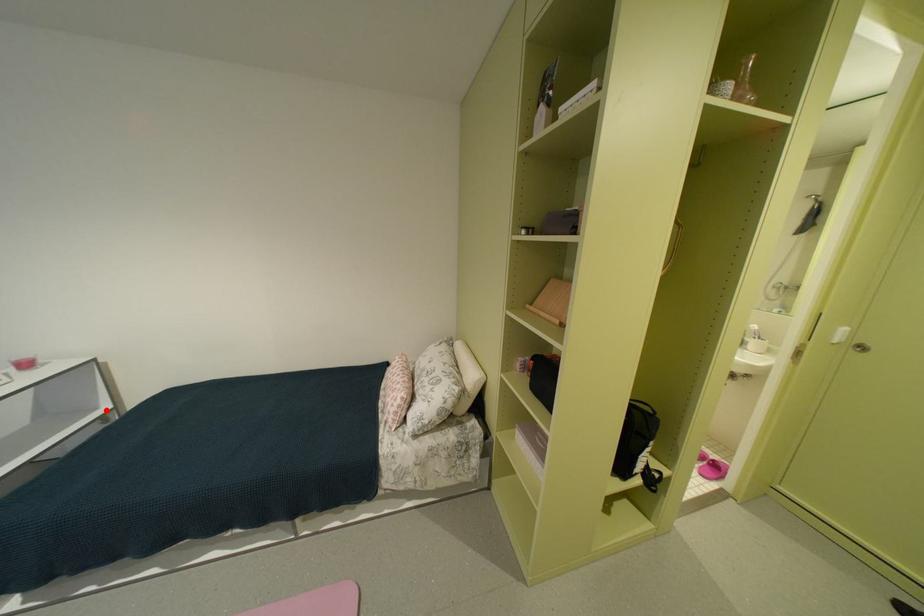
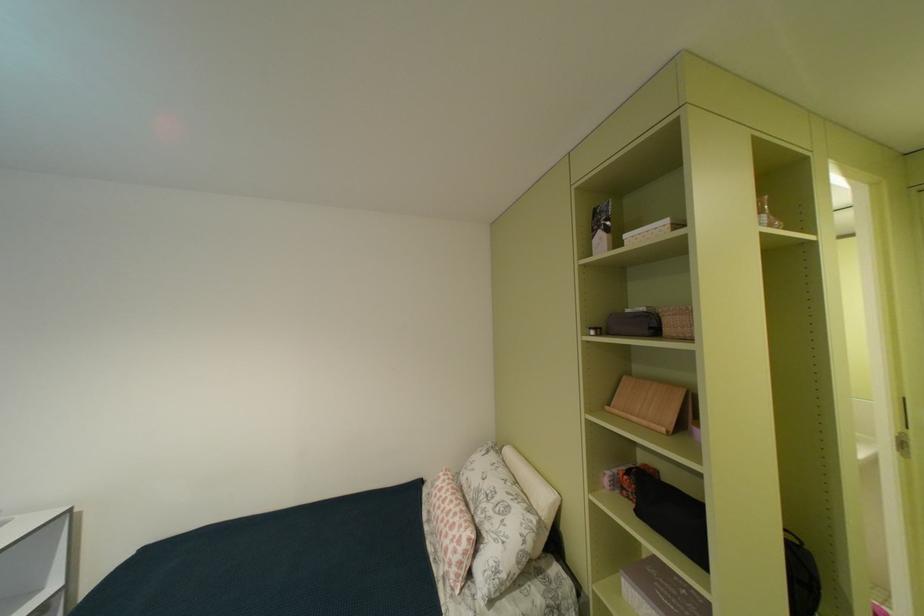
Question: I am providing you with two images of the same scene from different viewpoints. Given a red point in image1, look at the same physical point in image2. Is it:

Choices:
 (A) Closer to the viewpoint
 (B) Farther from the viewpoint

Answer: (B)